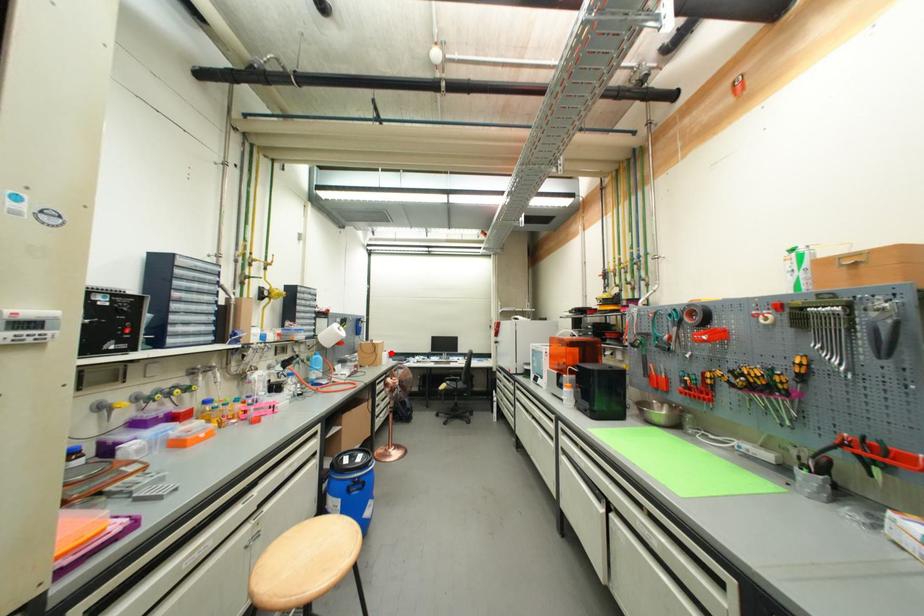
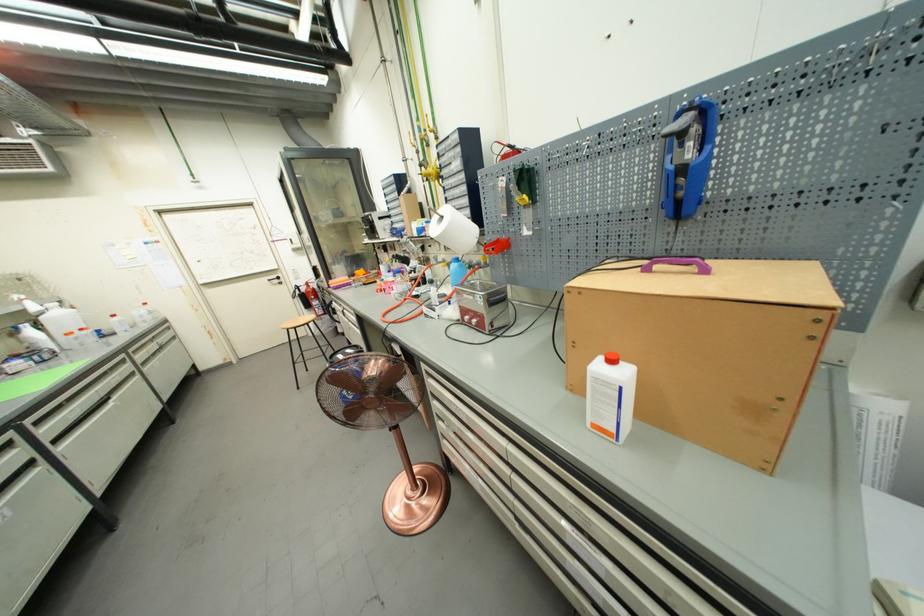
Question: I am providing you with two images of the same scene from different viewpoints. Given a red point in image1, look at the same physical point in image2. Is it:

Choices:
 (A) Closer to the viewpoint
 (B) Farther from the viewpoint

Answer: (B)